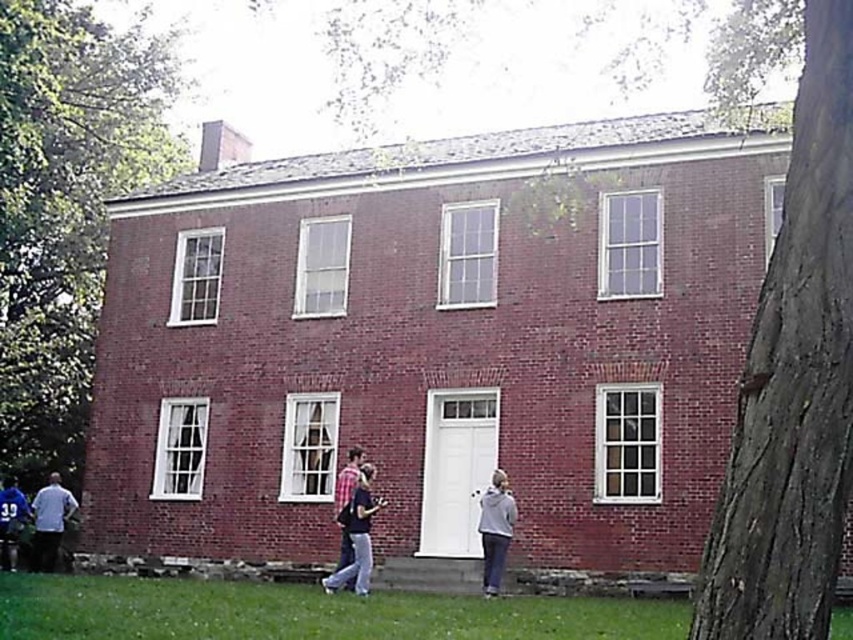
Between green leafy tree at lower left and matte pink shirt at center, which one has less height?

With less height is matte pink shirt at center.

Between green leafy tree at lower left and matte pink shirt at center, which one is positioned lower?

Positioned lower is matte pink shirt at center.

This screenshot has height=640, width=853. What do you see at coordinates (67, 205) in the screenshot?
I see `green leafy tree at lower left` at bounding box center [67, 205].

Image resolution: width=853 pixels, height=640 pixels. In order to click on green leafy tree at lower left in this screenshot , I will do `click(67, 205)`.

Between green leafy tree at lower left and gray fleece jacket at lower right, which one has less height?

gray fleece jacket at lower right is shorter.

This screenshot has width=853, height=640. In order to click on green leafy tree at lower left in this screenshot , I will do `click(67, 205)`.

Identify the location of green leafy tree at lower left. (67, 205).

Is brown rough bark tree at right wider than green leafy tree at lower left?

No.

Which is more to the left, brown rough bark tree at right or green leafy tree at lower left?

green leafy tree at lower left is more to the left.

Is point (750, 625) positioned before point (115, 60)?

Yes, it is in front of point (115, 60).

Find the location of a particular element. The image size is (853, 640). brown rough bark tree at right is located at coordinates (788, 346).